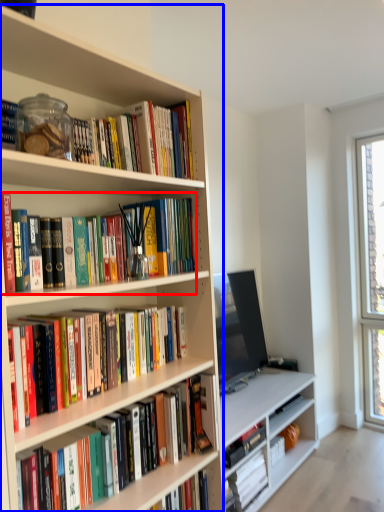
Question: Which object appears closest to the camera in this image, book (highlighted by a red box) or bookcase (highlighted by a blue box)?

Choices:
 (A) book
 (B) bookcase

Answer: (B)